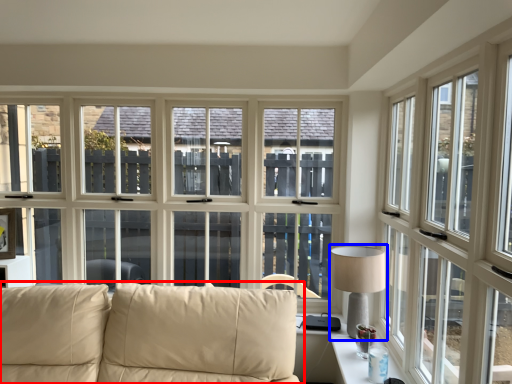
Question: Which of the following is the closest to the observer, studio couch (highlighted by a red box) or table lamp (highlighted by a blue box)?

Choices:
 (A) studio couch
 (B) table lamp

Answer: (A)